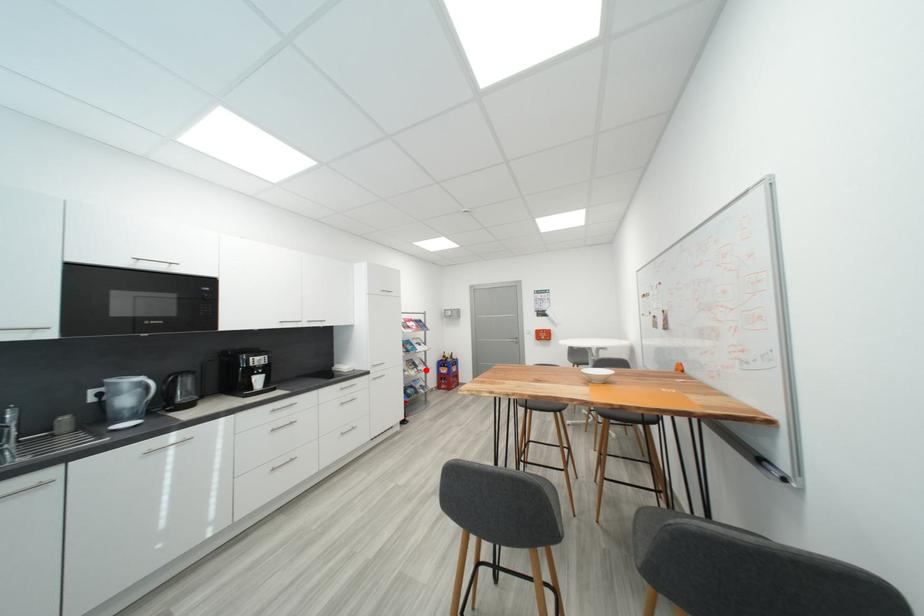
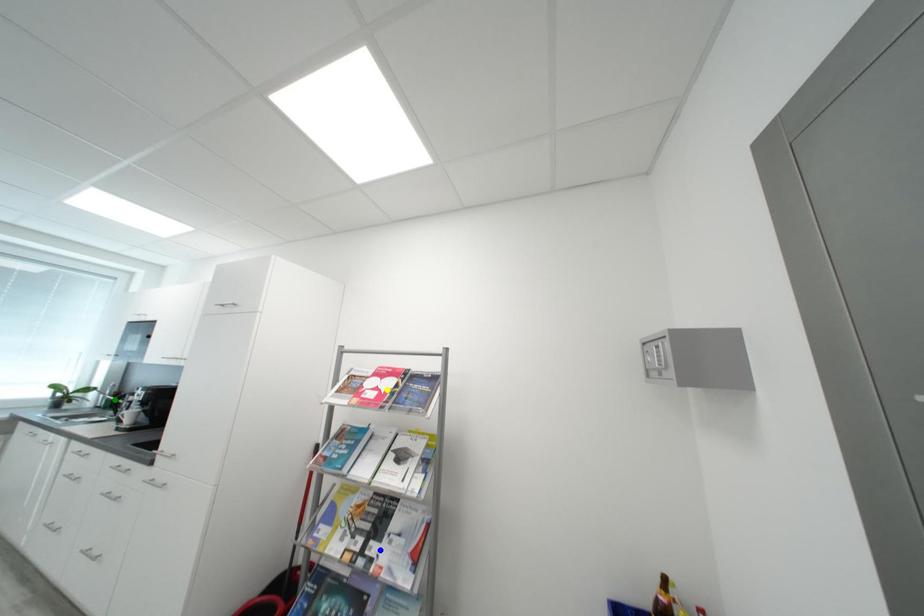
Question: I am providing you with two images of the same scene from different viewpoints. A red point is marked on the first image. You are given multiple points on the second image. Which mark in image 2 goes with the point in image 1?

Choices:
 (A) green point
 (B) yellow point
 (C) blue point

Answer: (C)